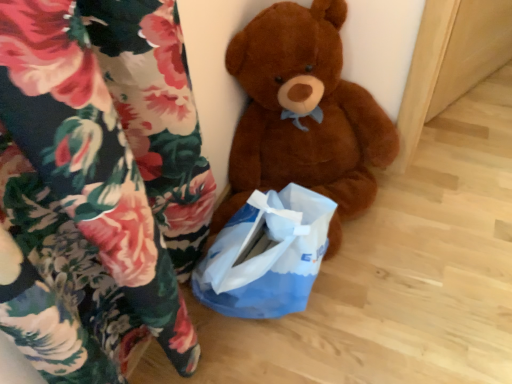
Question: Should I look upward or downward to see brown plush teddy bear at center?

Choices:
 (A) down
 (B) up

Answer: (B)